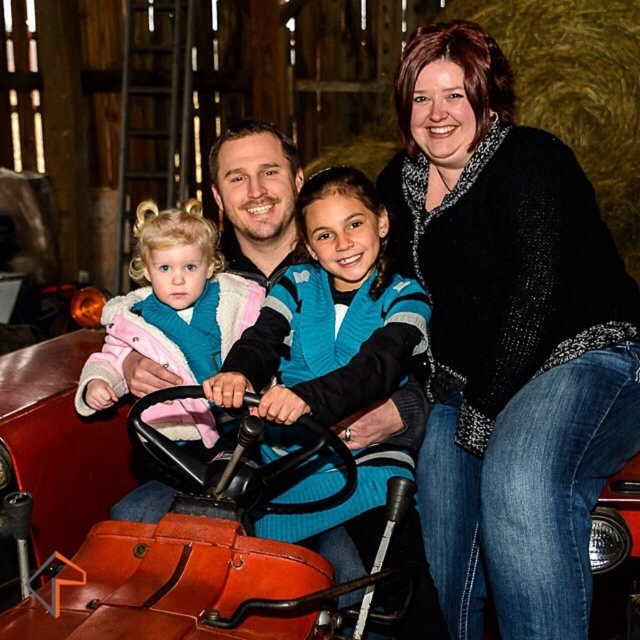
Question: Is black textured sweater at upper right wider than matte teal vest at center?

Choices:
 (A) no
 (B) yes

Answer: (B)

Question: Which of the following is the closest to the observer?

Choices:
 (A) matte teal vest at center
 (B) black textured sweater at upper right

Answer: (B)

Question: Is black textured sweater at upper right to the right of matte teal vest at center from the viewer's perspective?

Choices:
 (A) yes
 (B) no

Answer: (A)

Question: Can you confirm if black textured sweater at upper right is thinner than matte teal vest at center?

Choices:
 (A) yes
 (B) no

Answer: (B)

Question: Among these objects, which one is nearest to the camera?

Choices:
 (A) black textured sweater at upper right
 (B) matte teal vest at center

Answer: (A)